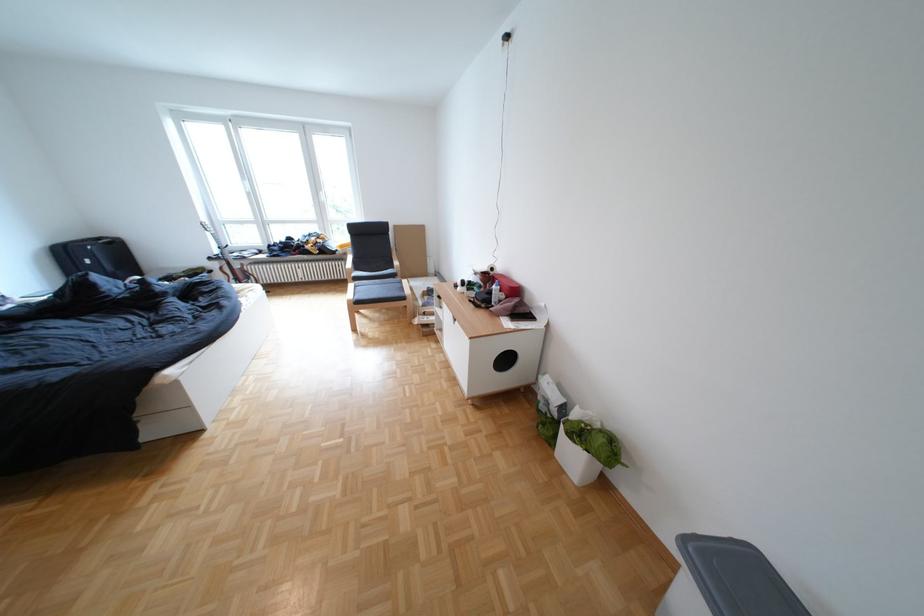
The height and width of the screenshot is (616, 924). What do you see at coordinates (378, 291) in the screenshot?
I see `the chair sitting surface` at bounding box center [378, 291].